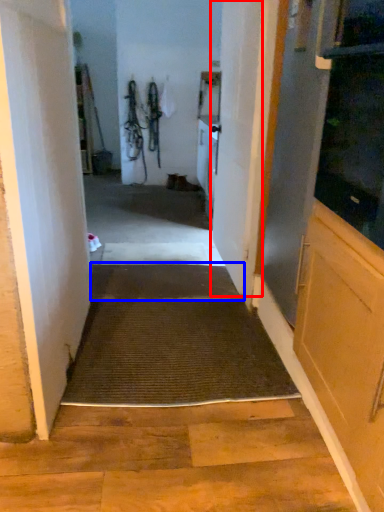
Question: Which of the following is the closest to the observer, door (highlighted by a red box) or doormat (highlighted by a blue box)?

Choices:
 (A) door
 (B) doormat

Answer: (A)